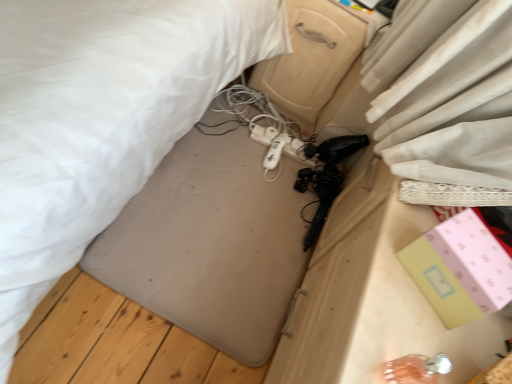
Question: Does beige plastic drawer at center have a larger size compared to white fabric bed at center?

Choices:
 (A) yes
 (B) no

Answer: (B)

Question: Does beige plastic drawer at center turn towards white fabric bed at center?

Choices:
 (A) yes
 (B) no

Answer: (A)

Question: Is beige plastic drawer at center smaller than white fabric bed at center?

Choices:
 (A) no
 (B) yes

Answer: (B)

Question: Considering the relative sizes of beige plastic drawer at center and white fabric bed at center in the image provided, is beige plastic drawer at center thinner than white fabric bed at center?

Choices:
 (A) yes
 (B) no

Answer: (A)

Question: Is beige plastic drawer at center turned away from white fabric bed at center?

Choices:
 (A) yes
 (B) no

Answer: (B)

Question: Is beige plastic drawer at center taller than white fabric bed at center?

Choices:
 (A) yes
 (B) no

Answer: (B)

Question: Does white fabric bed at center appear on the left side of beige plastic drawer at center?

Choices:
 (A) no
 (B) yes

Answer: (B)

Question: Can you confirm if white fabric bed at center is shorter than beige plastic drawer at center?

Choices:
 (A) yes
 (B) no

Answer: (B)

Question: Could you tell me if white fabric bed at center is facing beige plastic drawer at center?

Choices:
 (A) no
 (B) yes

Answer: (A)

Question: Is the depth of white fabric bed at center less than that of beige plastic drawer at center?

Choices:
 (A) yes
 (B) no

Answer: (A)

Question: Could beige plastic drawer at center be considered to be inside white fabric bed at center?

Choices:
 (A) yes
 (B) no

Answer: (A)

Question: From the image's perspective, does white fabric bed at center appear lower than beige plastic drawer at center?

Choices:
 (A) no
 (B) yes

Answer: (B)

Question: Is white plastic extension cord at center closer to the viewer compared to pink paper box at lower right?

Choices:
 (A) yes
 (B) no

Answer: (B)